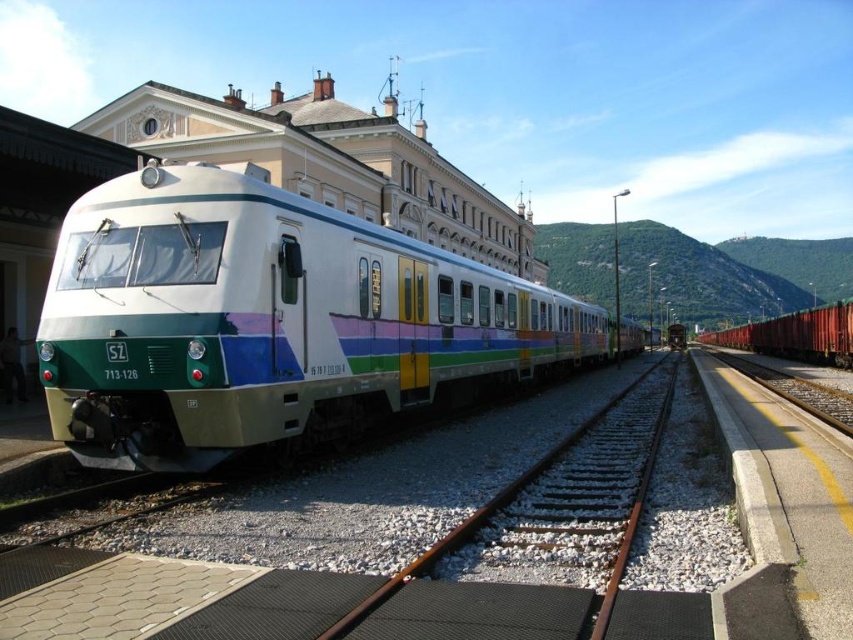
You are standing at the center of the train station platform. You need to locate the red matte freight car at right. Where exactly is it positioned relative to the platform?

The red matte freight car at right is positioned at point (795, 336) on the platform.

You are an engineer inspecting the train station. You notice the red matte freight car at right and the brown metal train track at center. Which object is directly above the other?

The red matte freight car at right is positioned over brown metal train track at center, so it is directly above the track.